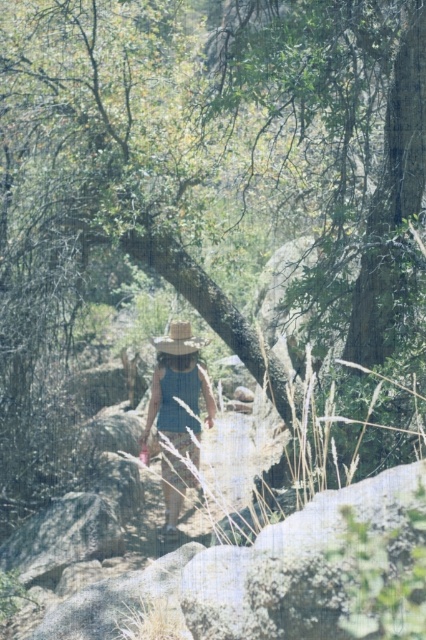
You are a photographer trying to capture the blue denim dress at center and the light brown straw cowboy hat at center in a single shot. Since you want both items to be clearly visible, which one should you focus on first to ensure it appears sharp?

You should focus on the blue denim dress at center first because it is in front of the light brown straw cowboy hat at center, so focusing on the closer object ensures both will be in focus if they are within the depth of field.

You are navigating through a rocky forest terrain and need to place two markers at specific coordinates. The first marker is at point (173, 352) and the second at point (186, 352). Which marker should you step over first if moving forward in the direction the person is walking?

You should step over the marker at point (173, 352) first because it is in front of the marker at point (186, 352) along the path the person is walking.